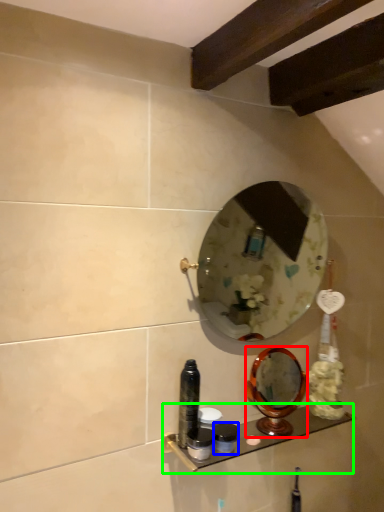
Question: Based on their relative distances, which object is farther from mirror (highlighted by a red box)? Choose from toiletry (highlighted by a blue box) and shelf (highlighted by a green box).

Choices:
 (A) toiletry
 (B) shelf

Answer: (A)